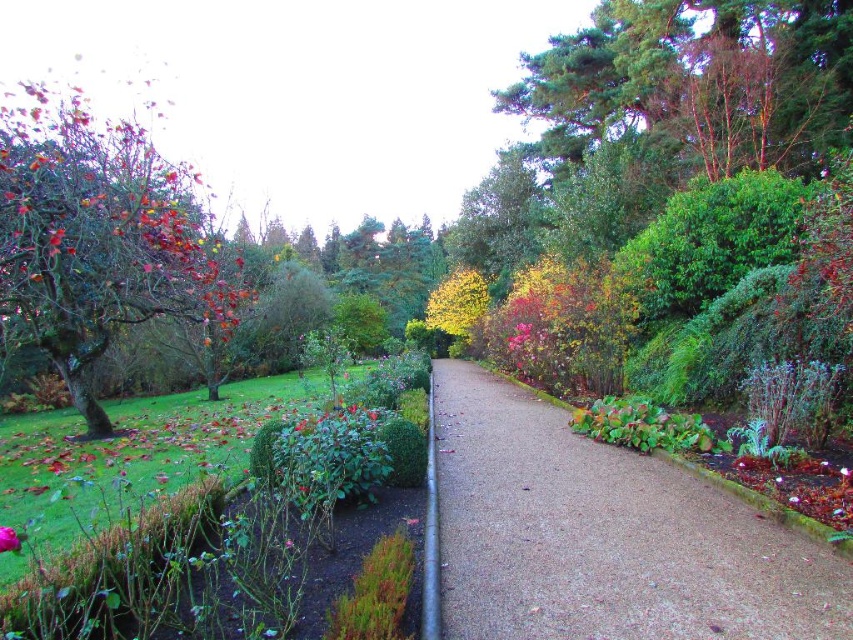
You are a gardener who wants to plant a new flower between the gravel at center and the purple matte flower at lower left. Based on their positions, where should you place the new flower?

Since the gravel at center is to the right of the purple matte flower at lower left, you should place the new flower between them, positioning it to the right of the purple matte flower at lower left and to the left of the gravel at center.